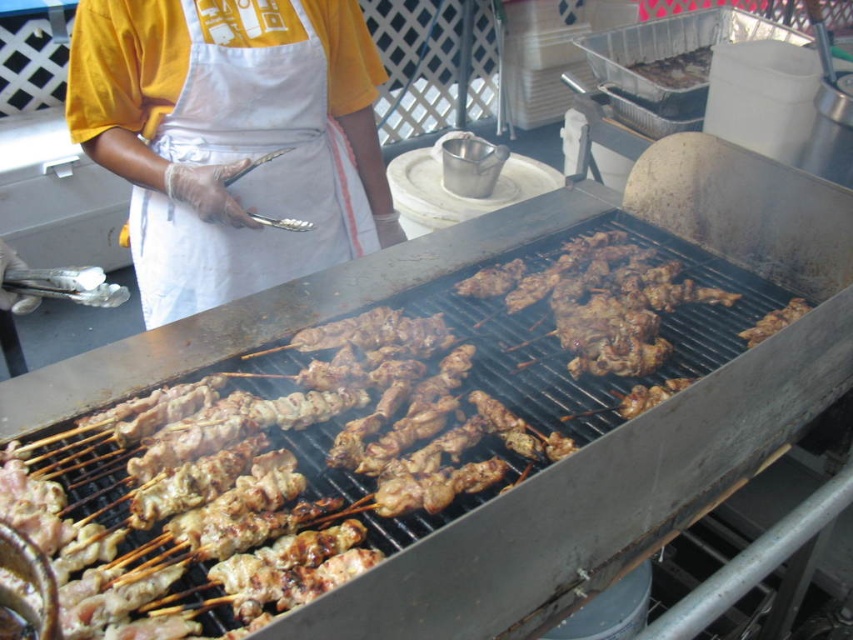
Between brown charred skewers at center and yellow fabric apron at upper center, which one appears on the right side from the viewer's perspective?

Positioned to the right is brown charred skewers at center.

Measure the distance from brown charred skewers at center to yellow fabric apron at upper center.

brown charred skewers at center is 17.91 inches from yellow fabric apron at upper center.

Is point (180, 614) positioned before point (88, 129)?

Yes, point (180, 614) is closer to viewer.

The image size is (853, 640). I want to click on brown charred skewers at center, so [286, 468].

Which is below, yellow fabric apron at upper center or brown charred meat at center?

Positioned lower is yellow fabric apron at upper center.

Between point (163, 6) and point (643, 65), which one is positioned behind?

The point (643, 65) is behind.

Is point (154, 257) farther from viewer compared to point (669, 81)?

No, (154, 257) is in front of (669, 81).

Where is `yellow fabric apron at upper center`? The height and width of the screenshot is (640, 853). yellow fabric apron at upper center is located at coordinates (231, 138).

Between point (218, 106) and point (776, 321), which one is positioned in front?

Positioned in front is point (218, 106).

Is yellow fabric apron at upper center positioned before brown charred chicken skewer at center?

Yes, it is.

Find the location of a particular element. yellow fabric apron at upper center is located at coordinates (231, 138).